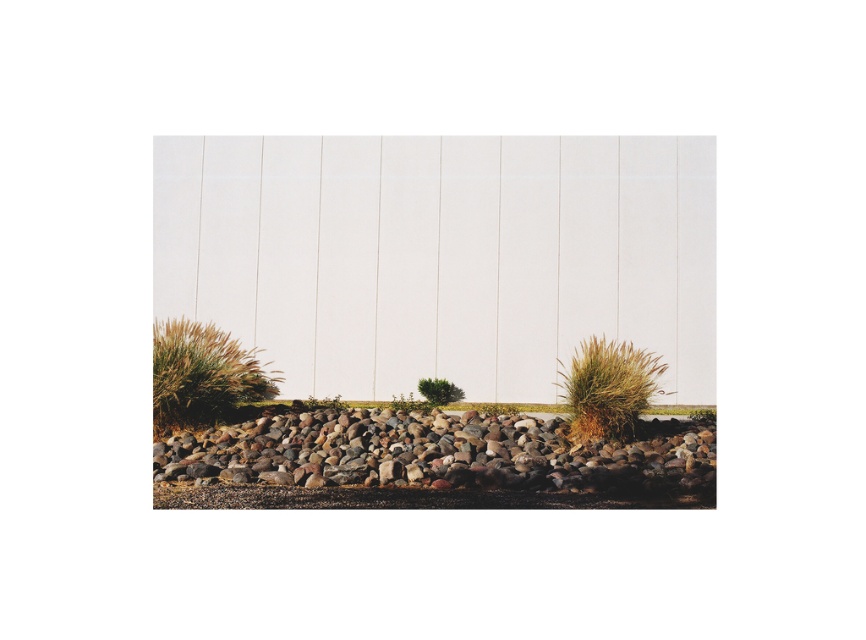
You are a gardener who needs to place a 10 feet long garden hose from the brown grass at lower left to the smooth brown stones at center. Based on the scene description, will the hose be long enough to reach? Please explain your reasoning.

The distance between the smooth brown stones at center and the brown grass at lower left is 8.34 feet. Since the garden hose is 10 feet long, it will be long enough to cover the distance between the two locations.

You are standing at the point marked as point (433, 464) in the image. What type of stones are present at your current location?

Smooth brown stones are present at point (433, 464).